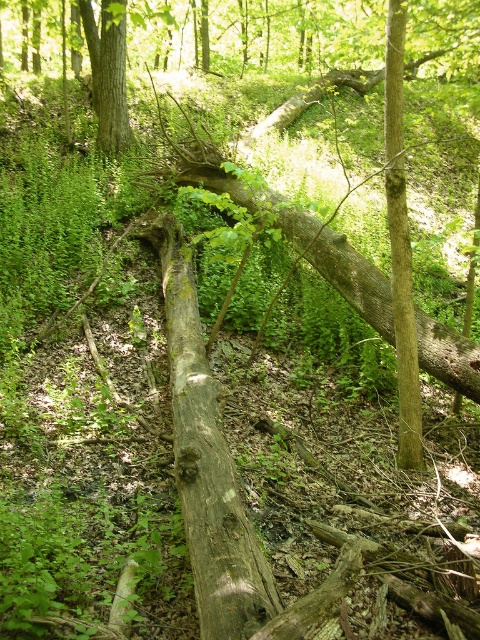
Question: Can you confirm if wooden log at center is positioned below smooth brown tree trunk at upper left?

Choices:
 (A) no
 (B) yes

Answer: (B)

Question: Which point is closer to the camera taking this photo?

Choices:
 (A) (93, 77)
 (B) (197, 416)

Answer: (B)

Question: Which object appears farthest from the camera in this image?

Choices:
 (A) wooden log at center
 (B) smooth brown tree trunk at upper left

Answer: (B)

Question: Which point is closer to the camera?

Choices:
 (A) smooth brown tree trunk at upper left
 (B) wooden log at center

Answer: (B)

Question: Is wooden log at center behind smooth brown tree trunk at upper left?

Choices:
 (A) yes
 (B) no

Answer: (B)

Question: Does wooden log at center appear on the left side of smooth brown tree trunk at upper left?

Choices:
 (A) yes
 (B) no

Answer: (B)